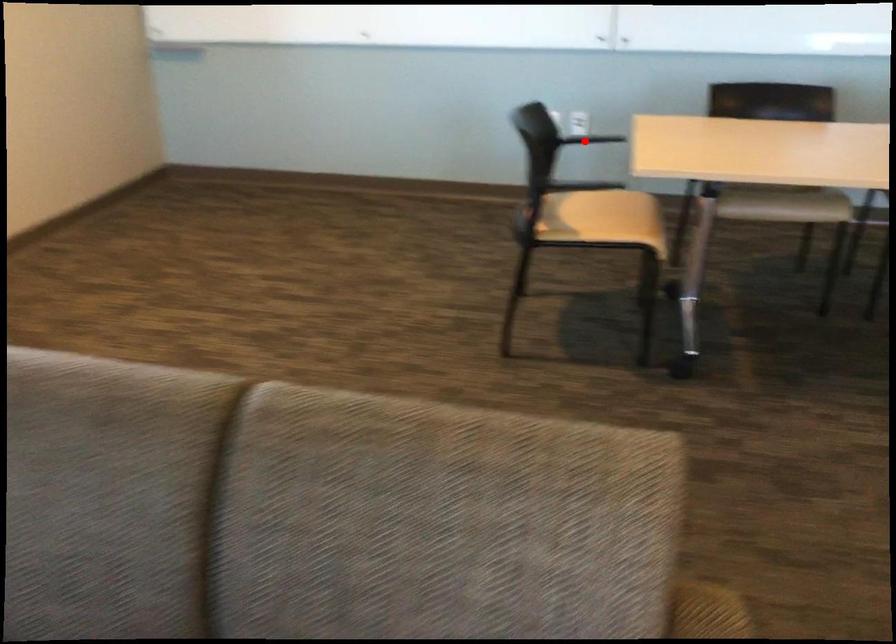
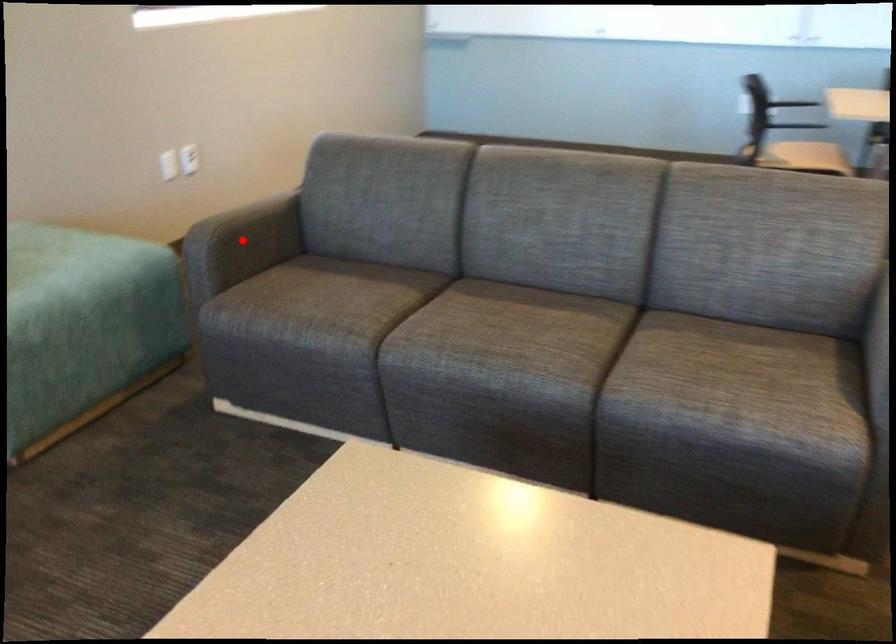
In the scene shown: I am providing you with two images of the same scene from different viewpoints. A red point is marked on the first image and another point is marked on the second image. Is the marked point in image1 the same physical position as the marked point in image2?

No